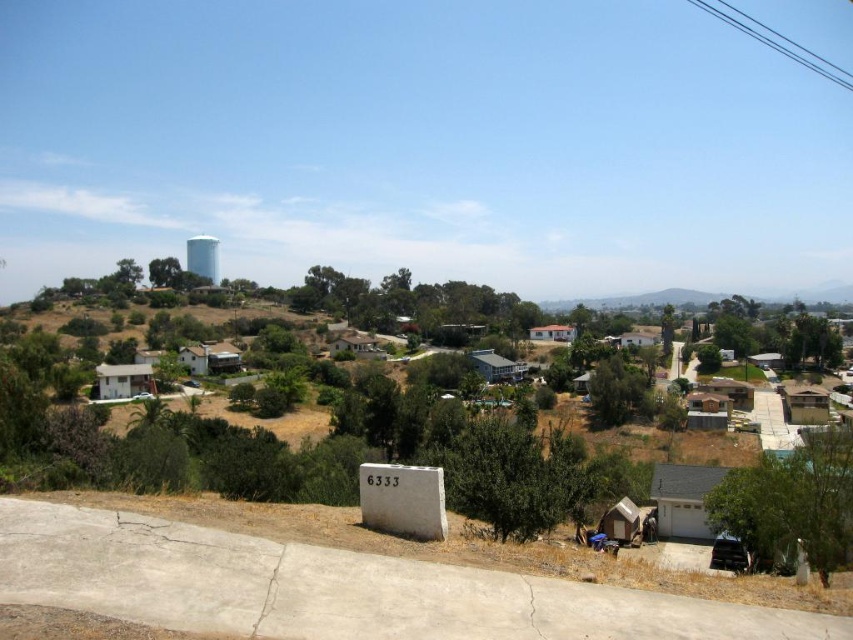
Question: Does green leafy tree at lower right have a larger size compared to blue glossy water tower at upper left?

Choices:
 (A) yes
 (B) no

Answer: (B)

Question: Estimate the real-world distances between objects in this image. Which object is farther from the green leafy tree at lower right?

Choices:
 (A) green leafy tree at center
 (B) blue glossy water tower at upper left

Answer: (B)

Question: Is green leafy tree at lower right to the left of blue glossy water tower at upper left from the viewer's perspective?

Choices:
 (A) no
 (B) yes

Answer: (A)

Question: Which point is closer to the camera taking this photo?

Choices:
 (A) (215, 273)
 (B) (840, 531)
 (C) (451, 298)

Answer: (B)

Question: Is green leafy tree at center wider than blue glossy water tower at upper left?

Choices:
 (A) no
 (B) yes

Answer: (B)

Question: Which point is farther from the camera taking this photo?

Choices:
 (A) (825, 580)
 (B) (465, 323)

Answer: (B)